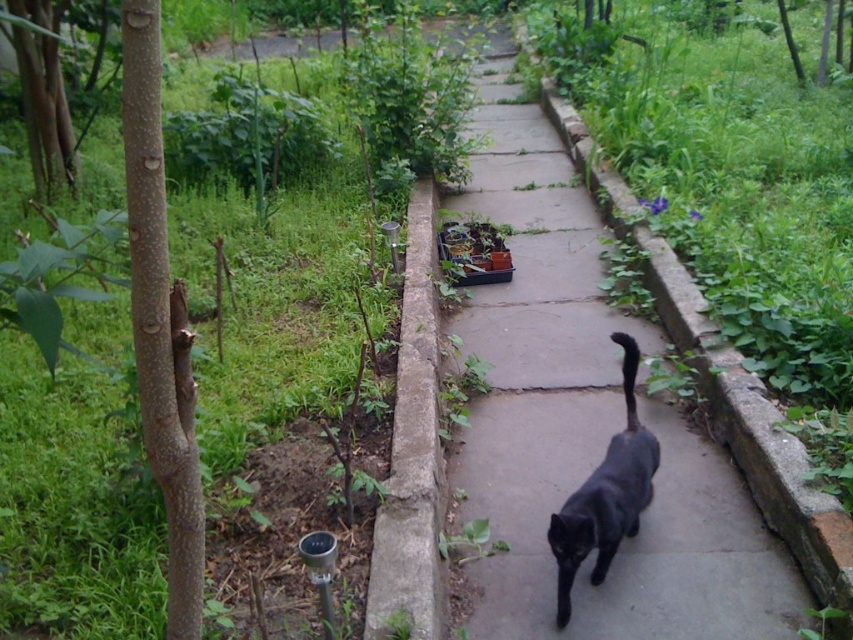
Question: Observing the image, what is the correct spatial positioning of concrete at center in reference to black matte cat at center?

Choices:
 (A) left
 (B) right

Answer: (A)

Question: Considering the real-world distances, which object is farthest from the black matte cat at center?

Choices:
 (A) concrete at center
 (B) green leafy plant at upper left

Answer: (B)

Question: Which is nearer to the black matte cat at center?

Choices:
 (A) green leafy plant at upper left
 (B) concrete at center

Answer: (B)

Question: Which of the following is the closest to the observer?

Choices:
 (A) green leafy plant at upper left
 (B) black matte cat at center

Answer: (A)

Question: Can you confirm if concrete at center is positioned to the left of black matte cat at center?

Choices:
 (A) yes
 (B) no

Answer: (A)

Question: Can you confirm if green leafy plant at upper left is positioned above black matte cat at center?

Choices:
 (A) yes
 (B) no

Answer: (A)